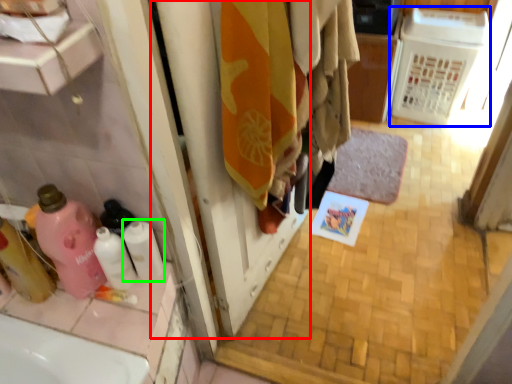
Question: Estimate the real-world distances between objects in this image. Which object is farther from screen door (highlighted by a red box), appliance (highlighted by a blue box) or toilet paper (highlighted by a green box)?

Choices:
 (A) appliance
 (B) toilet paper

Answer: (A)